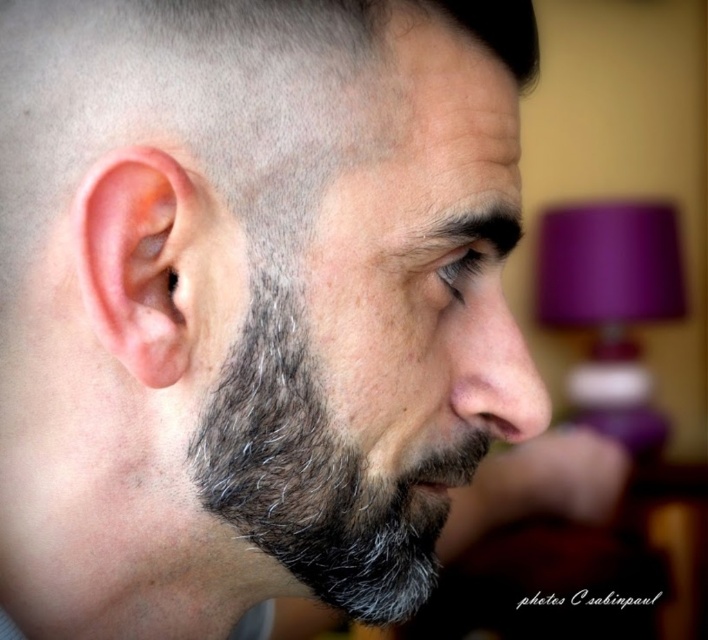
Question: Can you confirm if gray fuzzy beard at center is thinner than pink flesh/soft tissue ear at left?

Choices:
 (A) yes
 (B) no

Answer: (B)

Question: Among these objects, which one is nearest to the camera?

Choices:
 (A) gray fuzzy beard at center
 (B) pink flesh/soft tissue ear at left

Answer: (B)

Question: Can you confirm if gray fuzzy beard at center is positioned to the left of pink flesh/soft tissue ear at left?

Choices:
 (A) yes
 (B) no

Answer: (B)

Question: Does gray fuzzy beard at center come in front of pink flesh/soft tissue ear at left?

Choices:
 (A) yes
 (B) no

Answer: (B)